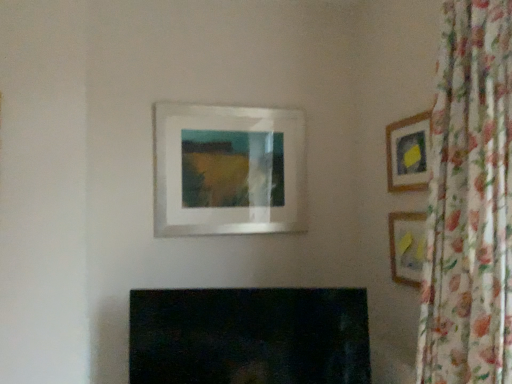
Question: From the image's perspective, is wooden frame at right, which is the 3th picture frame in left-to-right order, located above or below wooden frame at upper right, which appears as the second picture frame when viewed from the left?

Choices:
 (A) above
 (B) below

Answer: (B)

Question: Based on their positions, is wooden frame at right, which appears as the 1th picture frame when viewed from the right, located to the left or right of wooden frame at upper right, the 2th picture frame when ordered from right to left?

Choices:
 (A) right
 (B) left

Answer: (A)

Question: Based on their relative distances, which object is nearer to the floral fabric curtain at right?

Choices:
 (A) wooden frame at upper right, which appears as the second picture frame when viewed from the left
 (B) matte glass picture frame at center, positioned as the first picture frame in left-to-right order
 (C) wooden frame at right, which appears as the 1th picture frame when viewed from the right

Answer: (C)

Question: Which object is positioned closest to the matte glass picture frame at center, positioned as the 3th picture frame in right-to-left order?

Choices:
 (A) floral fabric curtain at right
 (B) wooden frame at upper right, which appears as the second picture frame when viewed from the left
 (C) wooden frame at right, which is the 3th picture frame in left-to-right order

Answer: (B)